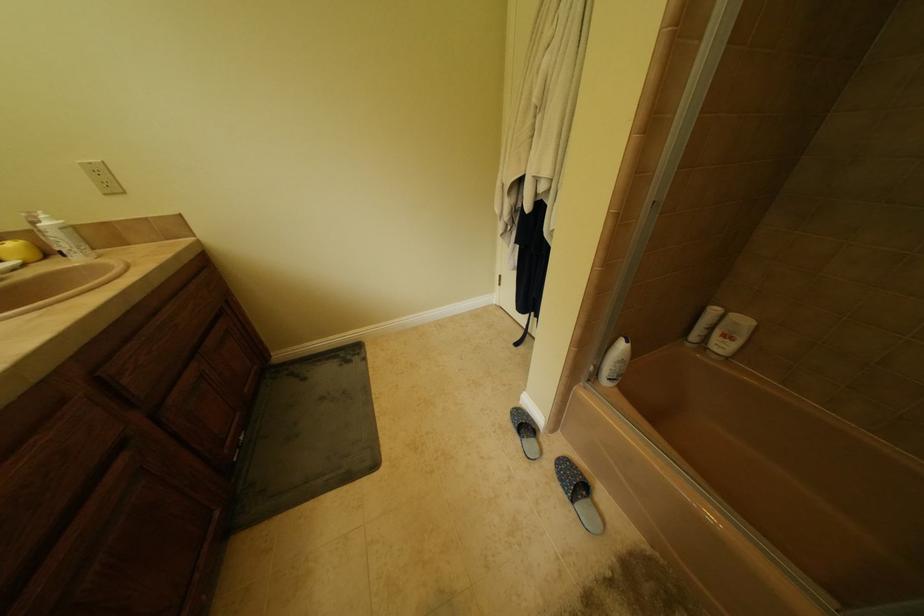
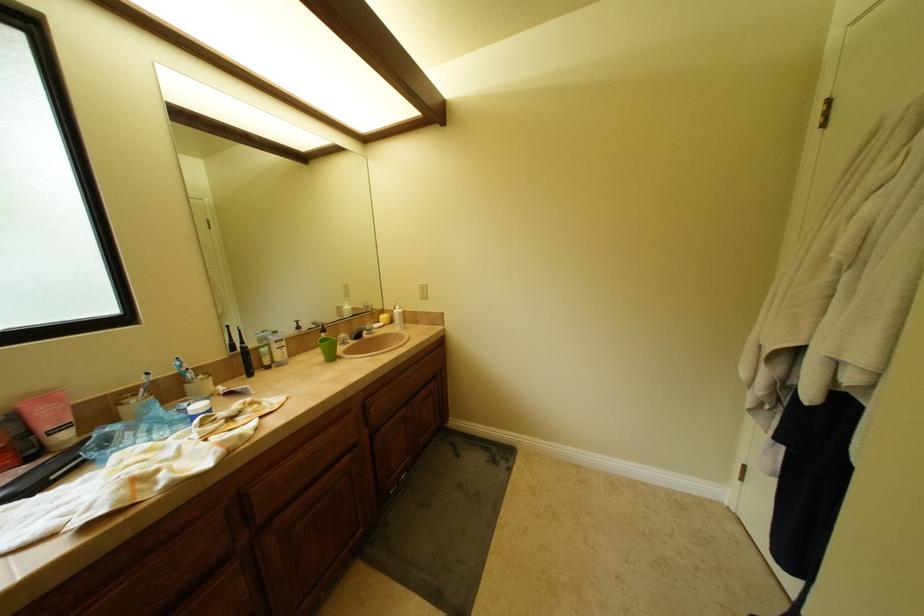
Question: How did the camera likely rotate?

Choices:
 (A) Left
 (B) Right
 (C) Up
 (D) Down

Answer: (A)